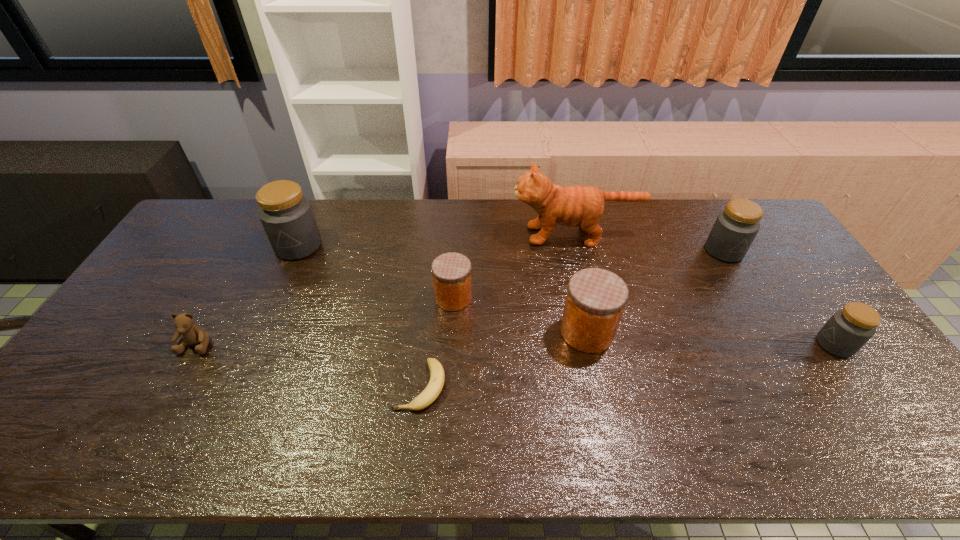
You are a GUI agent. You are given a task and a screenshot of the screen. Output one action in this format:
    pyautogui.click(x=<x>, y=<y>)
    Task: Click on the free spot between the leftmost gray jar and the seventh tallest object
    
    Given the screenshot: What is the action you would take?
    pyautogui.click(x=248, y=295)

Find the location of a particular element. Image resolution: width=960 pixels, height=540 pixels. free area in between the yellow banana and the smallest gray jar is located at coordinates (628, 365).

I want to click on free space between the second shortest object and the rightmost object, so click(516, 345).

Where is `vacant area that lies between the fourth jar from left to right and the right orange jar`? The height and width of the screenshot is (540, 960). vacant area that lies between the fourth jar from left to right and the right orange jar is located at coordinates (656, 292).

Image resolution: width=960 pixels, height=540 pixels. In order to click on free spot between the rightmost gray jar and the smaller orange jar in this screenshot , I will do `click(644, 321)`.

Identify which object is located as the fifth nearest to the yellow banana. Please provide its 2D coordinates. Your answer should be formatted as a tuple, i.e. [(x, y)], where the tuple contains the x and y coordinates of a point satisfying the conditions above.

[(192, 334)]

Where is `object identified as the seventh closest to the rightmost jar`? The width and height of the screenshot is (960, 540). object identified as the seventh closest to the rightmost jar is located at coordinates (192, 334).

Select which jar is the fifth closest to the banana. Please provide its 2D coordinates. Your answer should be formatted as a tuple, i.e. [(x, y)], where the tuple contains the x and y coordinates of a point satisfying the conditions above.

[(844, 334)]

Where is `jar that is the fourth closest to the biggest gray jar`? jar that is the fourth closest to the biggest gray jar is located at coordinates (844, 334).

You are a GUI agent. You are given a task and a screenshot of the screen. Output one action in this format:
    pyautogui.click(x=<x>, y=<y>)
    Task: Click on the gray jar object that ranks as the second closest to the fourth jar from right to left
    
    Given the screenshot: What is the action you would take?
    pyautogui.click(x=735, y=228)